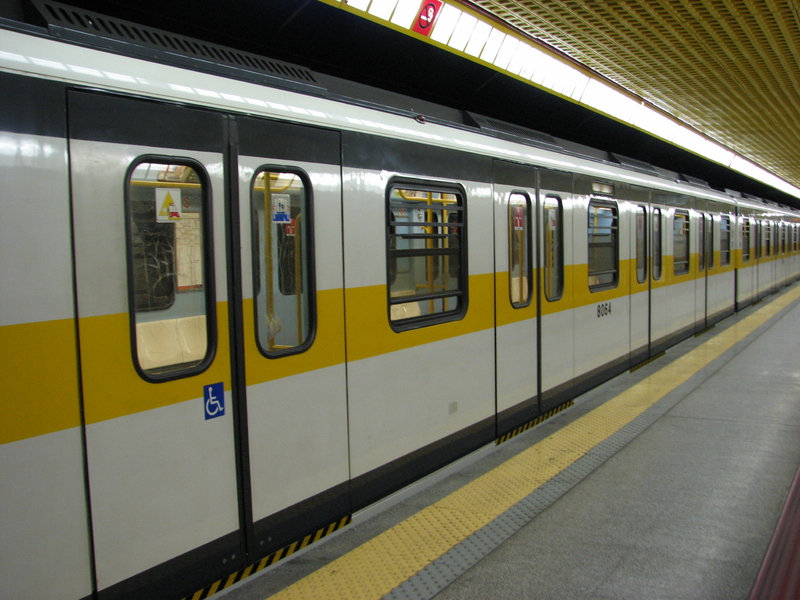
Where is `door`? The image size is (800, 600). door is located at coordinates (326, 430).